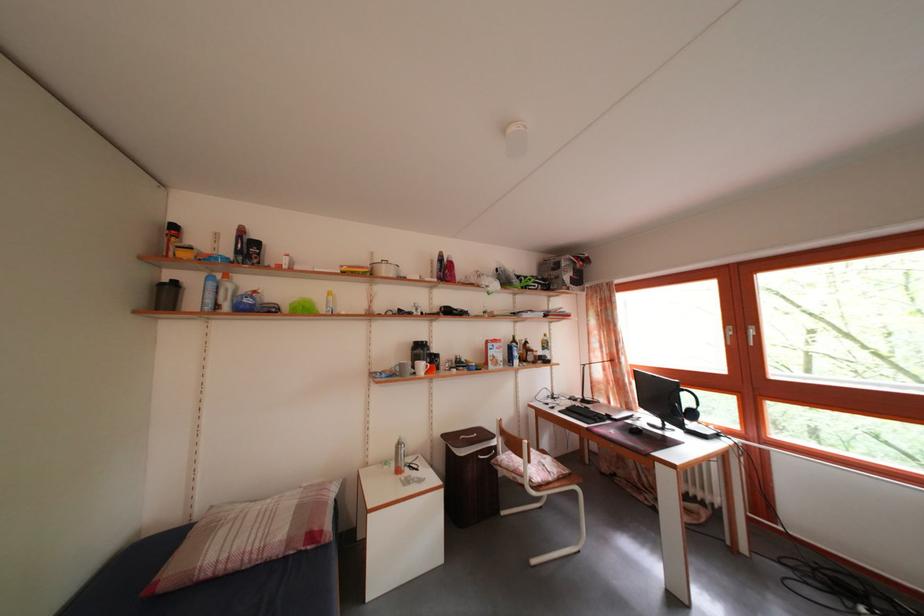
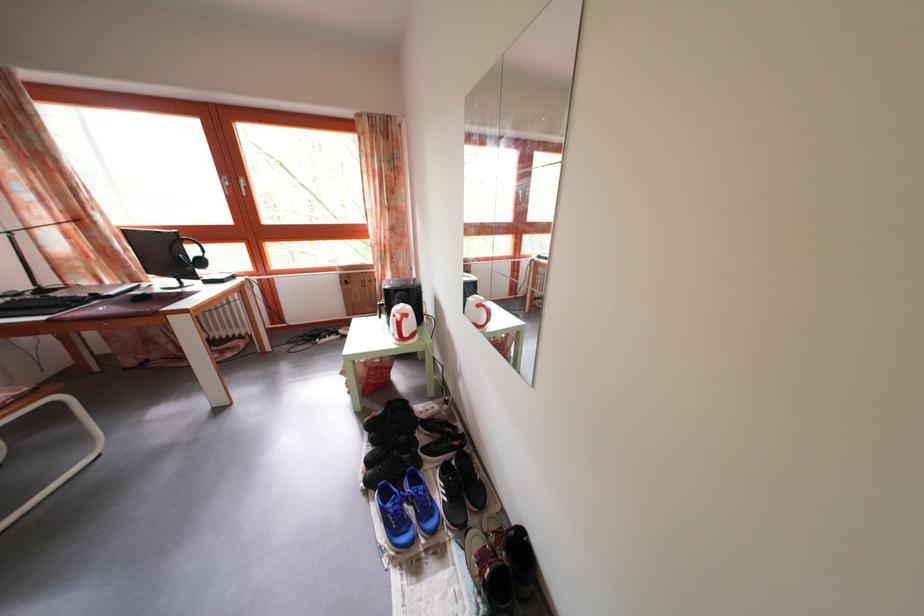
How did the camera likely rotate?

The camera rotated toward right-down.